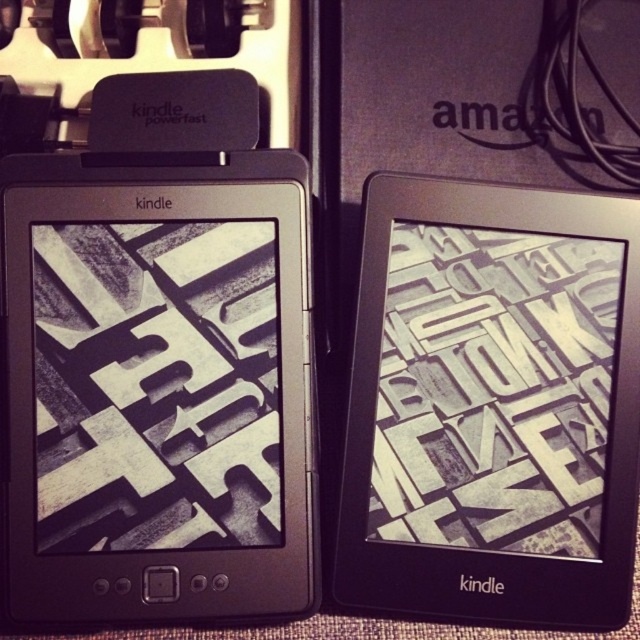
Question: Is black matte e-reader at left bigger than black matte kindle at right?

Choices:
 (A) yes
 (B) no

Answer: (A)

Question: Which point is closer to the camera taking this photo?

Choices:
 (A) (273, 211)
 (B) (460, 548)

Answer: (B)

Question: Is black matte e-reader at left positioned in front of black matte kindle at right?

Choices:
 (A) yes
 (B) no

Answer: (A)

Question: Can you confirm if black matte e-reader at left is positioned above black matte kindle at right?

Choices:
 (A) yes
 (B) no

Answer: (A)